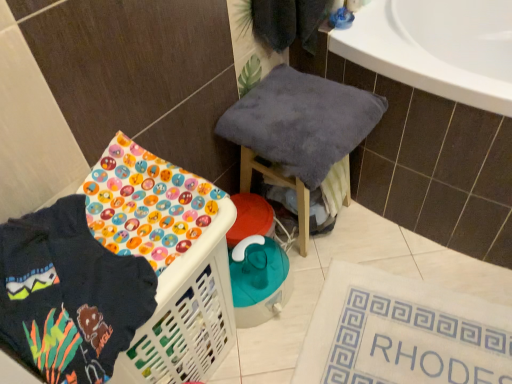
Question: Does soft gray towel at center have a larger size compared to white fabric bath mat at lower right?

Choices:
 (A) yes
 (B) no

Answer: (A)

Question: Is soft gray towel at center facing away from white fabric bath mat at lower right?

Choices:
 (A) no
 (B) yes

Answer: (A)

Question: From a real-world perspective, is soft gray towel at center on top of white fabric bath mat at lower right?

Choices:
 (A) yes
 (B) no

Answer: (A)

Question: Does soft gray towel at center touch white fabric bath mat at lower right?

Choices:
 (A) no
 (B) yes

Answer: (A)

Question: From a real-world perspective, is soft gray towel at center positioned under white fabric bath mat at lower right based on gravity?

Choices:
 (A) no
 (B) yes

Answer: (A)

Question: Is point [52, 294] closer or farther from the camera than point [245, 117]?

Choices:
 (A) farther
 (B) closer

Answer: (B)

Question: From their relative heights in the image, would you say dark blue fleece sweatshirt at lower left is taller or shorter than soft gray towel at center?

Choices:
 (A) short
 (B) tall

Answer: (A)

Question: From a real-world perspective, is dark blue fleece sweatshirt at lower left above or below soft gray towel at center?

Choices:
 (A) above
 (B) below

Answer: (A)

Question: Is dark blue fleece sweatshirt at lower left to the left or to the right of soft gray towel at center in the image?

Choices:
 (A) left
 (B) right

Answer: (A)

Question: From a real-world perspective, is dark blue fleece sweatshirt at lower left positioned above or below white fabric bath mat at lower right?

Choices:
 (A) above
 (B) below

Answer: (A)

Question: Based on their positions, is dark blue fleece sweatshirt at lower left located to the left or right of white fabric bath mat at lower right?

Choices:
 (A) left
 (B) right

Answer: (A)

Question: From the image's perspective, is dark blue fleece sweatshirt at lower left located above or below white fabric bath mat at lower right?

Choices:
 (A) below
 (B) above

Answer: (B)

Question: Is dark blue fleece sweatshirt at lower left spatially inside white fabric bath mat at lower right, or outside of it?

Choices:
 (A) outside
 (B) inside

Answer: (A)

Question: Is white fabric bath mat at lower right wider or thinner than dark blue fleece sweatshirt at lower left?

Choices:
 (A) wide
 (B) thin

Answer: (A)

Question: Would you say white fabric bath mat at lower right is inside or outside dark blue fleece sweatshirt at lower left?

Choices:
 (A) outside
 (B) inside

Answer: (A)